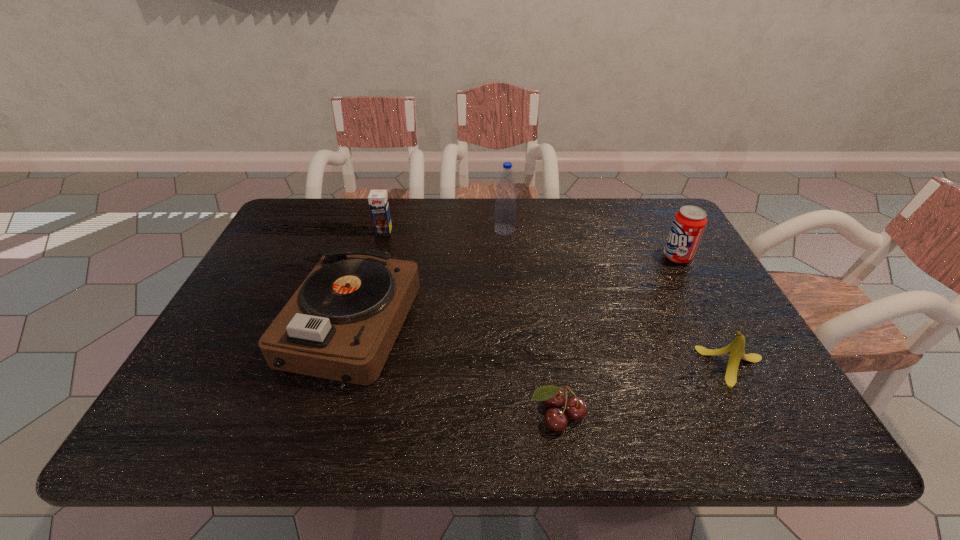
Identify the location of the tallest object. The height and width of the screenshot is (540, 960). (505, 206).

Identify the location of the fourth nearest object. (689, 222).

Where is `chocolate milk`? This screenshot has width=960, height=540. chocolate milk is located at coordinates (378, 201).

Identify the location of record player. (341, 324).

You are a GUI agent. You are given a task and a screenshot of the screen. Output one action in this format:
    pyautogui.click(x=<x>, y=<y>)
    Task: Click on the banana
    
    Given the screenshot: What is the action you would take?
    pyautogui.click(x=736, y=348)

Find the location of a particular element. the shortest object is located at coordinates tap(575, 408).

This screenshot has height=540, width=960. In order to click on vacant area situated 0.210m on the left of the water bottle in this screenshot , I will do `click(425, 230)`.

Locate an element on the screen. free location located 0.060m on the surface of the soda can is located at coordinates (x=641, y=256).

Locate an element on the screen. Image resolution: width=960 pixels, height=540 pixels. vacant region located 0.240m on the surface of the soda can is located at coordinates (578, 256).

Image resolution: width=960 pixels, height=540 pixels. What are the coordinates of `free space located on the surface of the soda can` in the screenshot? It's located at [549, 256].